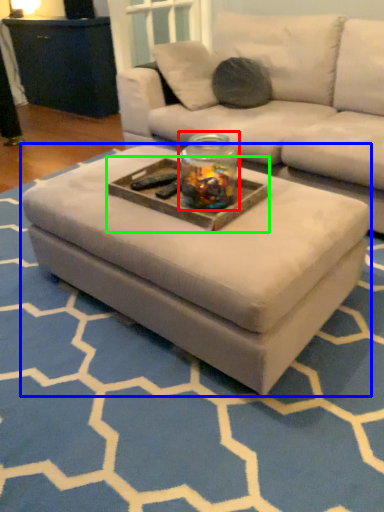
Question: Which object is the farthest from glass jar (highlighted by a red box)? Choose among these: coffee table (highlighted by a blue box) or tray (highlighted by a green box).

Choices:
 (A) coffee table
 (B) tray

Answer: (A)